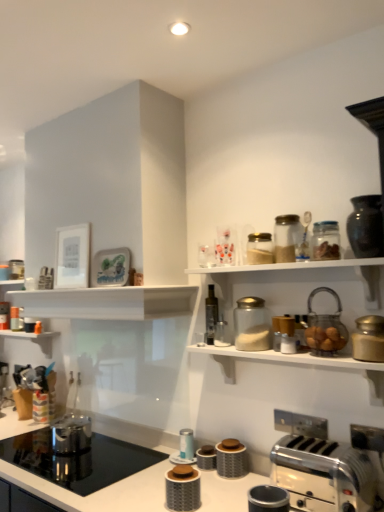
Question: Would you say gold metallic canister at upper right, the eleventh appliance positioned from the left, is outside shiny dark brown vase at upper right, positioned as the first appliance in right-to-left order?

Choices:
 (A) no
 (B) yes

Answer: (B)

Question: From the image's perspective, would you say gold metallic canister at upper right, the eleventh appliance positioned from the left, is positioned over shiny dark brown vase at upper right, positioned as the first appliance in right-to-left order?

Choices:
 (A) no
 (B) yes

Answer: (A)

Question: Is shiny dark brown vase at upper right, which is the 12th appliance in left-to-right order, located within gold metallic canister at upper right, which is the 2th appliance from right to left?

Choices:
 (A) yes
 (B) no

Answer: (B)

Question: From a real-world perspective, is gold metallic canister at upper right, the eleventh appliance positioned from the left, physically below shiny dark brown vase at upper right, positioned as the first appliance in right-to-left order?

Choices:
 (A) no
 (B) yes

Answer: (B)

Question: Is gold metallic canister at upper right, which is the 2th appliance from right to left, wider than shiny dark brown vase at upper right, positioned as the first appliance in right-to-left order?

Choices:
 (A) yes
 (B) no

Answer: (B)

Question: In the image, is translucent glass jar at upper center, marked as the 5th appliance in a right-to-left arrangement, positioned in front of or behind transparent glass jar at upper center, the 6th appliance positioned from the right?

Choices:
 (A) behind
 (B) front

Answer: (A)

Question: From a real-world perspective, relative to transparent glass jar at upper center, the 6th appliance positioned from the right, is translucent glass jar at upper center, marked as the 5th appliance in a right-to-left arrangement, vertically above or below?

Choices:
 (A) below
 (B) above

Answer: (B)

Question: From the image's perspective, relative to transparent glass jar at upper center, the 6th appliance positioned from the right, is translucent glass jar at upper center, marked as the 5th appliance in a right-to-left arrangement, above or below?

Choices:
 (A) above
 (B) below

Answer: (A)

Question: Does point (271, 260) appear closer or farther from the camera than point (251, 323)?

Choices:
 (A) closer
 (B) farther

Answer: (A)

Question: Choose the correct answer: Is translucent glass jar at upper right, which ranks as the second glass jar in left-to-right order, inside shiny metallic kettle at lower left, the first appliance from the left, or outside it?

Choices:
 (A) inside
 (B) outside

Answer: (B)

Question: From the image's perspective, relative to shiny metallic kettle at lower left, the first appliance from the left, is translucent glass jar at upper right, which ranks as the second glass jar in left-to-right order, above or below?

Choices:
 (A) below
 (B) above

Answer: (B)

Question: Considering their positions, is translucent glass jar at upper right, arranged as the first glass jar when viewed from the right, located in front of or behind shiny metallic kettle at lower left, the first appliance from the left?

Choices:
 (A) behind
 (B) front

Answer: (B)

Question: Considering the positions of translucent glass jar at upper right, arranged as the first glass jar when viewed from the right, and shiny metallic kettle at lower left, the first appliance from the left, in the image, is translucent glass jar at upper right, arranged as the first glass jar when viewed from the right, taller or shorter than shiny metallic kettle at lower left, the first appliance from the left,?

Choices:
 (A) tall
 (B) short

Answer: (B)

Question: In the image, is metallic silver toaster at lower right, which ranks as the 6th appliance in left-to-right order, positioned in front of or behind metallic silver canister at center, marked as the 9th appliance in a right-to-left arrangement?

Choices:
 (A) behind
 (B) front

Answer: (B)

Question: From the image's perspective, is metallic silver toaster at lower right, which ranks as the 6th appliance in left-to-right order, located above or below metallic silver canister at center, marked as the fourth appliance in a left-to-right arrangement?

Choices:
 (A) below
 (B) above

Answer: (B)